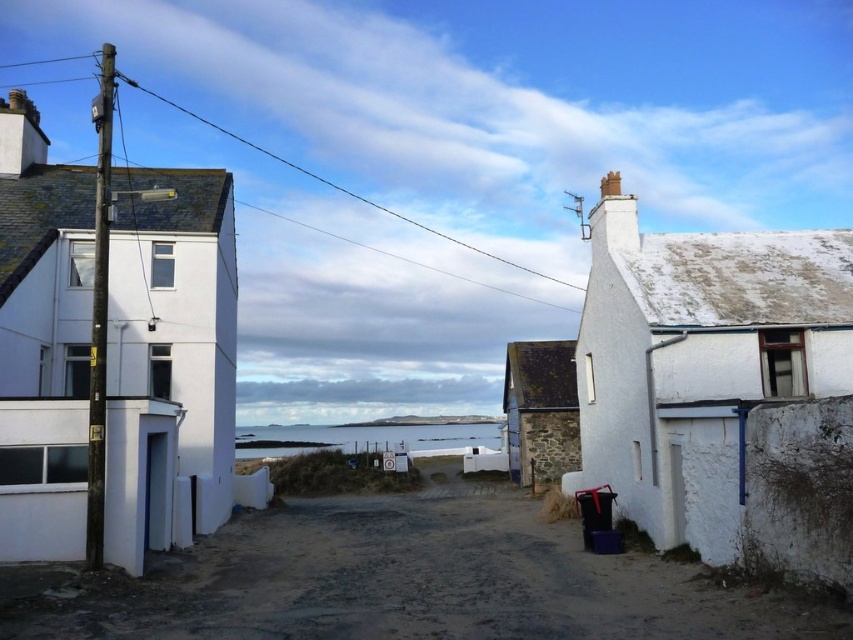
Consider the image. You are a delivery person trying to park your 2.5 meter wide truck between the white matte house at left and the white rough stone cottage at right. The road between them is narrow. Based on the scene, can your truck fit sideways between them?

The white matte house at left is taller than the white rough stone cottage at right, but the description does not provide information about the width of the road between them. Therefore, it is unclear if the truck can fit sideways between them.

You are standing on the dirt ground at center and want to walk towards the rustic stone cottage at center. Which direction should you move?

You should move to the right because the dirt ground at center is to the left of rustic stone cottage at center, so moving right will take you towards it.